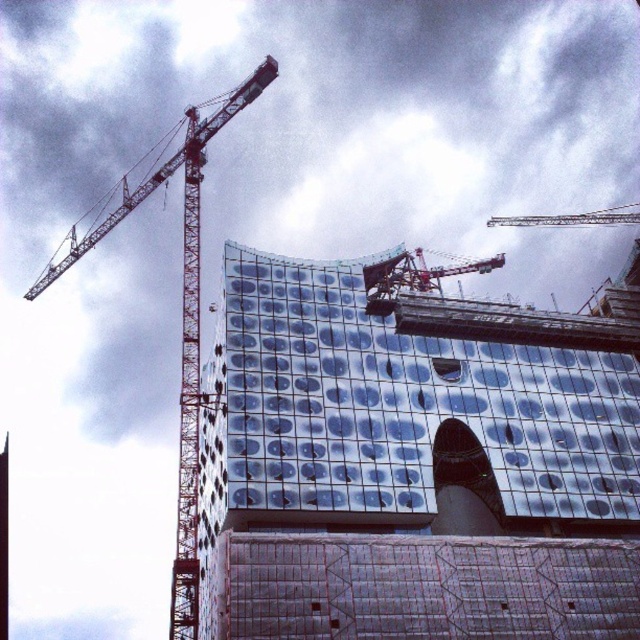
Question: Which point is closer to the camera?

Choices:
 (A) (307, 371)
 (B) (200, 132)

Answer: (A)

Question: Can you confirm if metallic glass building at center is thinner than metallic silver crane at upper center?

Choices:
 (A) yes
 (B) no

Answer: (B)

Question: Estimate the real-world distances between objects in this image. Which object is farther from the reddish metallic crane at left?

Choices:
 (A) metallic gray crane at upper center
 (B) metallic glass building at center

Answer: (A)

Question: Considering the real-world distances, which object is farthest from the metallic gray crane at upper center?

Choices:
 (A) metallic silver crane at upper center
 (B) metallic glass building at center
 (C) reddish metallic crane at left

Answer: (C)

Question: Does metallic gray crane at upper center appear under metallic silver crane at upper center?

Choices:
 (A) no
 (B) yes

Answer: (B)

Question: Can you confirm if metallic glass building at center is bigger than metallic silver crane at upper center?

Choices:
 (A) no
 (B) yes

Answer: (B)